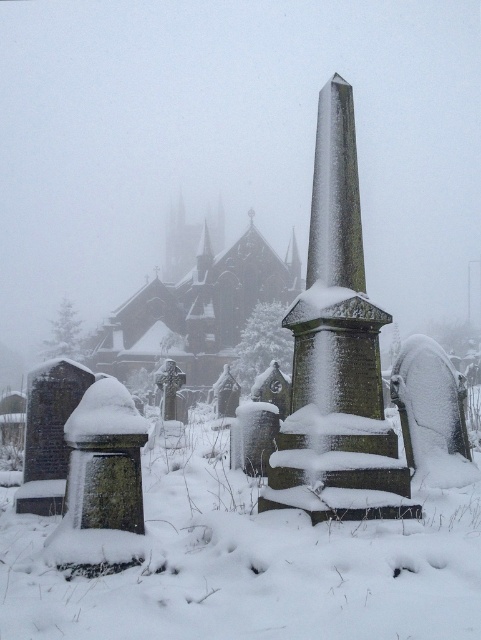
Question: Which object is farther from the camera taking this photo?

Choices:
 (A) dark brown stone church at center
 (B) green mossy gravestone at lower left

Answer: (A)

Question: Does dark brown stone church at center come behind green mossy gravestone at lower left?

Choices:
 (A) no
 (B) yes

Answer: (B)

Question: Which point appears closest to the camera in this image?

Choices:
 (A) tap(114, 458)
 (B) tap(114, 320)

Answer: (A)

Question: Is the position of dark brown stone church at center less distant than that of green mossy gravestone at lower left?

Choices:
 (A) yes
 (B) no

Answer: (B)

Question: Does dark brown stone church at center come in front of green mossy gravestone at lower left?

Choices:
 (A) yes
 (B) no

Answer: (B)